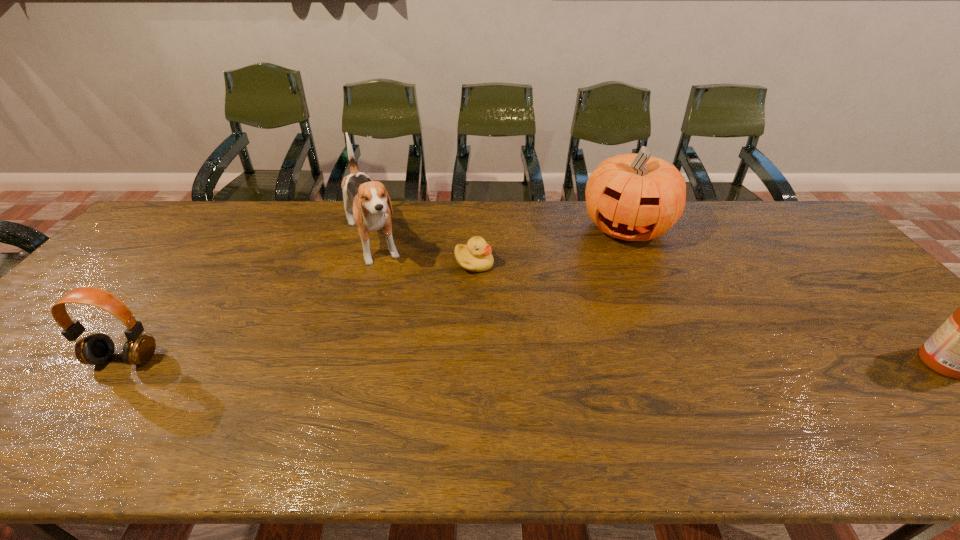
The width and height of the screenshot is (960, 540). What are the coordinates of `vacant space on the desktop that is between the leftmost object and the fruit juice and is positioned on the front-facing side of the shortest object` in the screenshot? It's located at (564, 361).

At what (x,y) coordinates should I click in order to perform the action: click on vacant space on the desktop that is between the leftmost object and the fruit juice and is positioned on the front-facing side of the second object from right to left. Please return your answer as a coordinate pair (x, y). Looking at the image, I should click on (580, 361).

You are a GUI agent. You are given a task and a screenshot of the screen. Output one action in this format:
    pyautogui.click(x=<x>, y=<y>)
    Task: Click on the free space on the desktop that is between the leftmost object and the fruit juice and is positioned at the face of the fourth object from right to left
    The height and width of the screenshot is (540, 960).
    Given the screenshot: What is the action you would take?
    pyautogui.click(x=427, y=361)